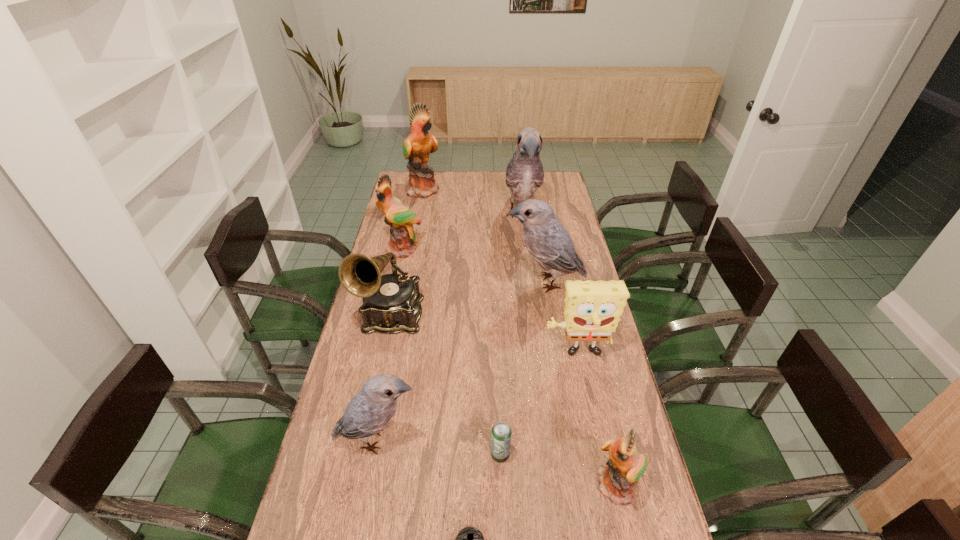
Find the location of a particular element. the nearest parrot is located at coordinates (626, 465).

Where is `beer can`? beer can is located at coordinates (501, 434).

You are a GUI agent. You are given a task and a screenshot of the screen. Output one action in this format:
    pyautogui.click(x=<x>, y=<y>)
    Task: Click on the ninth tallest object
    The width and height of the screenshot is (960, 540).
    Given the screenshot: What is the action you would take?
    pyautogui.click(x=501, y=434)

The height and width of the screenshot is (540, 960). Identify the location of free space located 0.080m on the front-facing side of the farthest green parrot. (x=458, y=190).

Locate an element on the screen. The width and height of the screenshot is (960, 540). vacant space situated 0.050m on the front-facing side of the biggest gray parrot is located at coordinates (526, 248).

Where is `free space located 0.200m on the front-facing side of the second farthest green parrot`? This screenshot has width=960, height=540. free space located 0.200m on the front-facing side of the second farthest green parrot is located at coordinates (393, 294).

I want to click on vacant space located on the front-facing side of the fourth farthest parrot, so click(465, 282).

Where is `free space located 0.390m on the front-facing side of the fourth farthest parrot`? free space located 0.390m on the front-facing side of the fourth farthest parrot is located at coordinates (402, 282).

Identify the location of free space located on the front-facing side of the fourth farthest parrot. (439, 282).

You are a GUI agent. You are given a task and a screenshot of the screen. Output one action in this format:
    pyautogui.click(x=<x>, y=<y>)
    Task: Click on the free space located on the horn of the phonograph record
    
    Given the screenshot: What is the action you would take?
    (x=363, y=448)